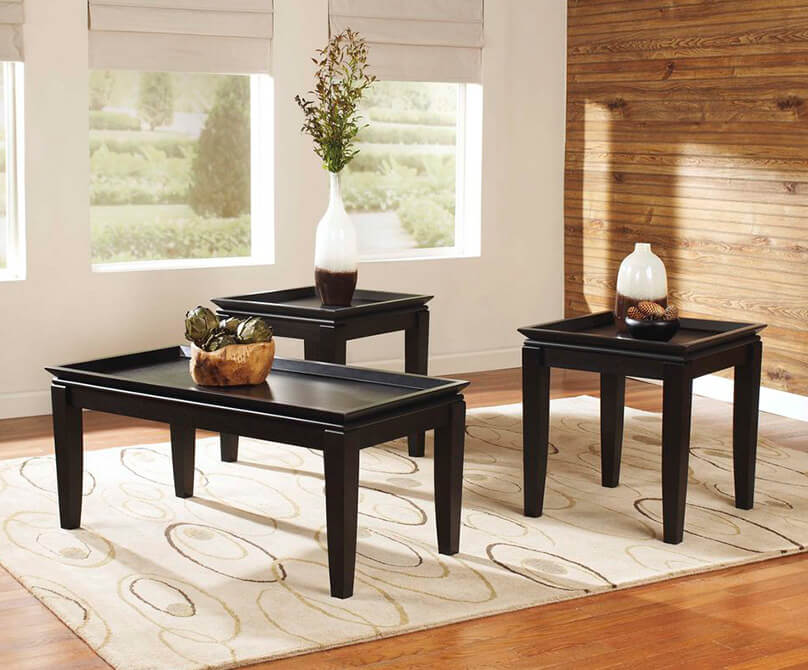
At what (x,y) coordinates should I click in order to perform the action: click on tables. Please return your answer as a coordinate pair (x, y). This screenshot has width=808, height=670. Looking at the image, I should click on (356, 295), (566, 338), (388, 415).